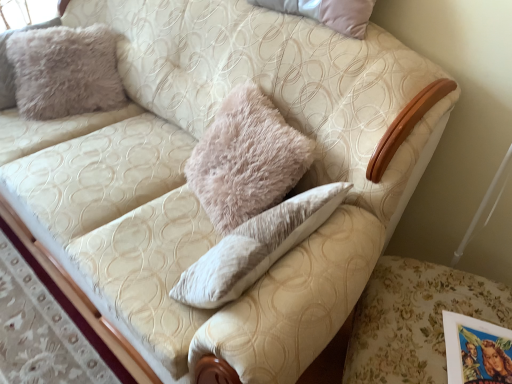
Identify the location of fuzzy beige pillow at upper left. (65, 71).

What do you see at coordinates (65, 71) in the screenshot? I see `fuzzy beige pillow at upper left` at bounding box center [65, 71].

Describe the element at coordinates (415, 320) in the screenshot. I see `floral fabric swivel chair at lower right` at that location.

The image size is (512, 384). I want to click on floral fabric swivel chair at lower right, so click(x=415, y=320).

Where is `fuzzy beige pillow at upper left`? The height and width of the screenshot is (384, 512). fuzzy beige pillow at upper left is located at coordinates (65, 71).

Considering the positions of objects fuzzy beige pillow at upper left and floral fabric swivel chair at lower right in the image provided, who is more to the left, fuzzy beige pillow at upper left or floral fabric swivel chair at lower right?

fuzzy beige pillow at upper left is more to the left.

Is the depth of fuzzy beige pillow at upper left less than that of floral fabric swivel chair at lower right?

No, the depth of fuzzy beige pillow at upper left is greater than that of floral fabric swivel chair at lower right.

Is point (59, 50) closer to camera compared to point (425, 321)?

No, (59, 50) is behind (425, 321).

From the image's perspective, is fuzzy beige pillow at upper left on top of floral fabric swivel chair at lower right?

Indeed, from the image's perspective, fuzzy beige pillow at upper left is shown above floral fabric swivel chair at lower right.

From a real-world perspective, is fuzzy beige pillow at upper left above or below floral fabric swivel chair at lower right?

fuzzy beige pillow at upper left is situated higher than floral fabric swivel chair at lower right in the real world.

Is fuzzy beige pillow at upper left thinner than floral fabric swivel chair at lower right?

Yes.

Which of these two, fuzzy beige pillow at upper left or floral fabric swivel chair at lower right, stands taller?

Standing taller between the two is fuzzy beige pillow at upper left.

Is fuzzy beige pillow at upper left bigger or smaller than floral fabric swivel chair at lower right?

Clearly, fuzzy beige pillow at upper left is smaller in size than floral fabric swivel chair at lower right.

Is fuzzy beige pillow at upper left spatially inside floral fabric swivel chair at lower right, or outside of it?

fuzzy beige pillow at upper left is located beyond the bounds of floral fabric swivel chair at lower right.

Is fuzzy beige pillow at upper left with floral fabric swivel chair at lower right?

No, fuzzy beige pillow at upper left is not with floral fabric swivel chair at lower right.

Is floral fabric swivel chair at lower right at the back of fuzzy beige pillow at upper left?

No.

This screenshot has width=512, height=384. Find the location of `swivel chair located on the right of fuzzy beige pillow at upper left`. swivel chair located on the right of fuzzy beige pillow at upper left is located at coordinates (415, 320).

Which is more to the right, floral fabric swivel chair at lower right or fuzzy beige pillow at upper left?

floral fabric swivel chair at lower right is more to the right.

Relative to fuzzy beige pillow at upper left, is floral fabric swivel chair at lower right in front or behind?

Clearly, floral fabric swivel chair at lower right is in front of fuzzy beige pillow at upper left.

Is point (387, 320) closer or farther from the camera than point (106, 82)?

Point (387, 320) is closer to the camera than point (106, 82).

From the image's perspective, relative to fuzzy beige pillow at upper left, is floral fabric swivel chair at lower right above or below?

floral fabric swivel chair at lower right is situated lower than fuzzy beige pillow at upper left in the image.

From a real-world perspective, is floral fabric swivel chair at lower right positioned above or below fuzzy beige pillow at upper left?

floral fabric swivel chair at lower right is situated lower than fuzzy beige pillow at upper left in the real world.

Is floral fabric swivel chair at lower right wider than fuzzy beige pillow at upper left?

Yes, floral fabric swivel chair at lower right is wider than fuzzy beige pillow at upper left.

Can you confirm if floral fabric swivel chair at lower right is taller than fuzzy beige pillow at upper left?

No, floral fabric swivel chair at lower right is not taller than fuzzy beige pillow at upper left.

Between floral fabric swivel chair at lower right and fuzzy beige pillow at upper left, which one has smaller size?

fuzzy beige pillow at upper left is smaller.

Is fuzzy beige pillow at upper left a part of floral fabric swivel chair at lower right?

No, fuzzy beige pillow at upper left is not a part of floral fabric swivel chair at lower right.

From the picture: Is floral fabric swivel chair at lower right far away from fuzzy beige pillow at upper left?

Absolutely, floral fabric swivel chair at lower right is distant from fuzzy beige pillow at upper left.

Looking at this image, is floral fabric swivel chair at lower right positioned with its back to fuzzy beige pillow at upper left?

No, fuzzy beige pillow at upper left is not at the back of floral fabric swivel chair at lower right.

How different are the orientations of floral fabric swivel chair at lower right and fuzzy beige pillow at upper left in degrees?

There is a 55.1-degree angle between the facing directions of floral fabric swivel chair at lower right and fuzzy beige pillow at upper left.

Find the location of `swivel chair below the fuzzy beige pillow at upper left (from a real-world perspective)`. swivel chair below the fuzzy beige pillow at upper left (from a real-world perspective) is located at coordinates (415, 320).

Image resolution: width=512 pixels, height=384 pixels. What are the coordinates of `swivel chair below the fuzzy beige pillow at upper left (from a real-world perspective)` in the screenshot? It's located at (415, 320).

Image resolution: width=512 pixels, height=384 pixels. I want to click on pillow that is on the left side of floral fabric swivel chair at lower right, so click(65, 71).